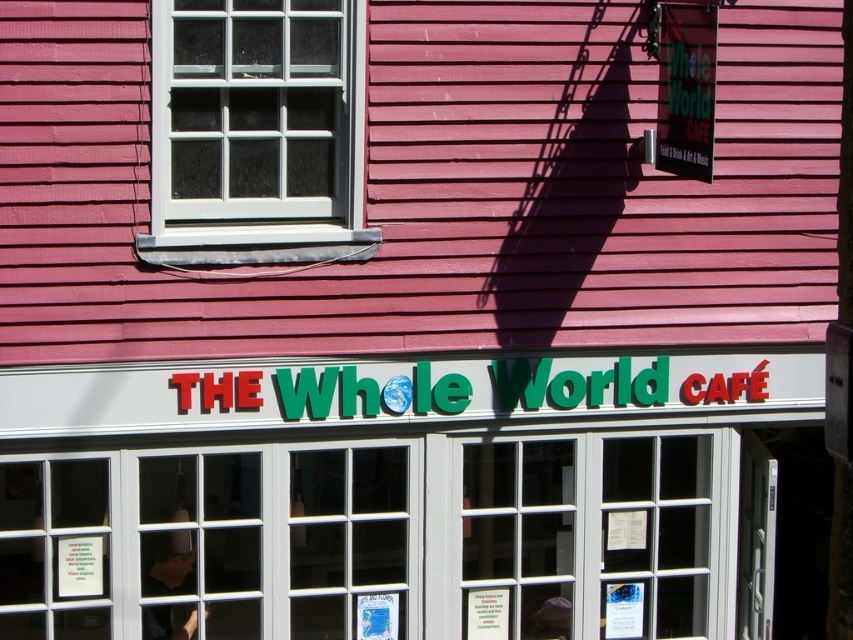
Which is more to the left, white glass window at upper left or green plastic sign at upper right?

Positioned to the left is white glass window at upper left.

Is white glass window at upper left smaller than green plastic sign at upper right?

No.

Find the location of a particular element. The height and width of the screenshot is (640, 853). white glass window at upper left is located at coordinates (257, 122).